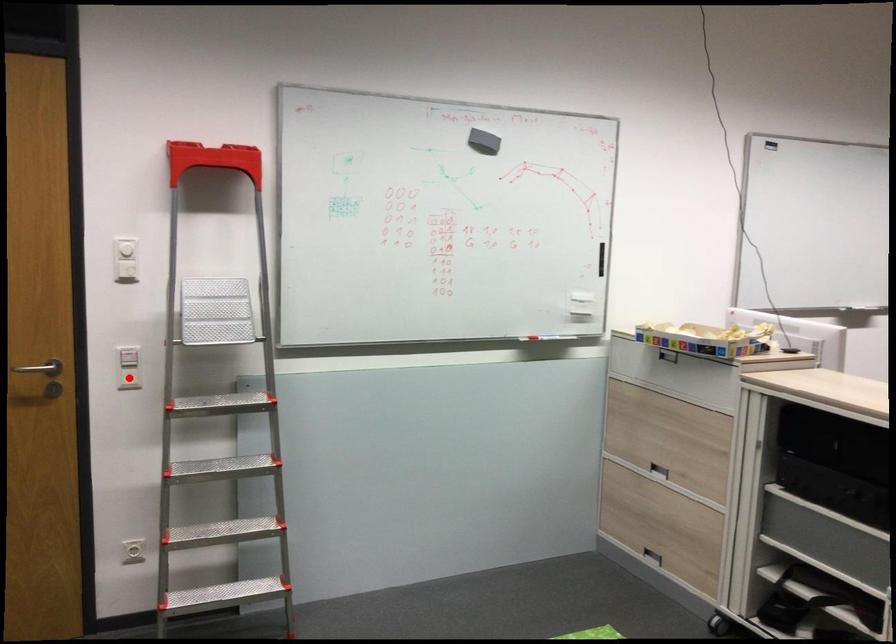
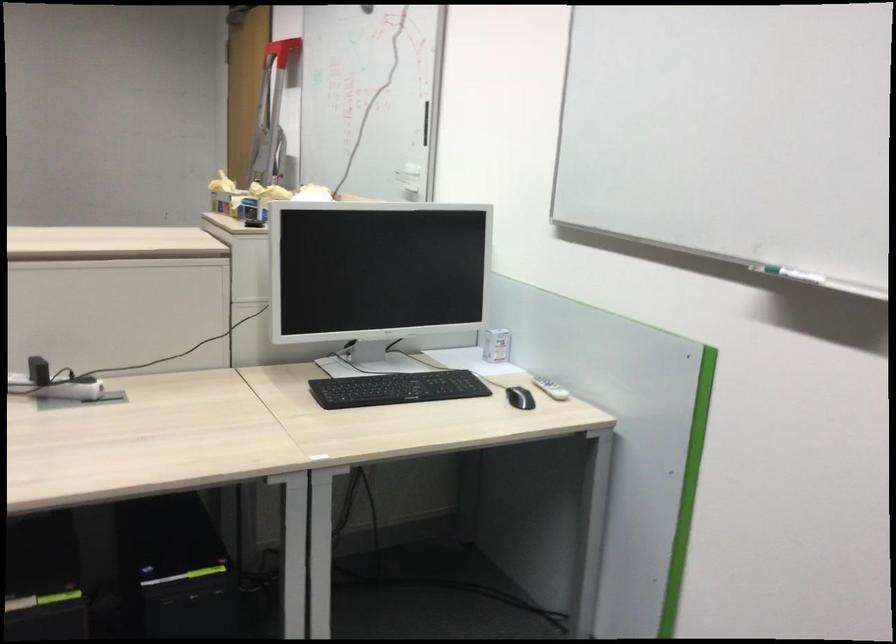
Question: I am providing you with two images of the same scene from different viewpoints. A red point is marked on the first image. At the location where the point appears in image 1, is it still visible in image 2?

Choices:
 (A) Yes
 (B) No

Answer: (B)